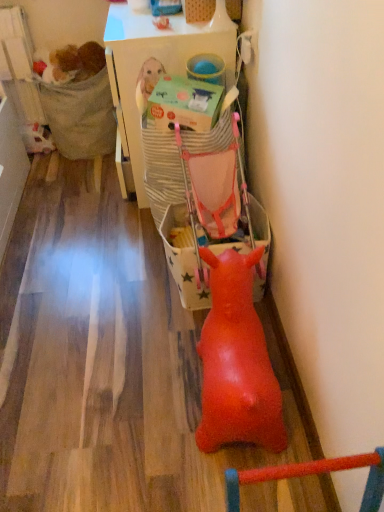
Describe the element at coordinates (80, 116) in the screenshot. This screenshot has width=384, height=512. I see `textured fabric chair at left` at that location.

The height and width of the screenshot is (512, 384). I want to click on matte green cardboard box at center, so click(x=184, y=104).

Locate an element on the screen. rubber duck at center is located at coordinates (236, 361).

Measure the distance between point (217, 196) and camera.

Point (217, 196) is 4.96 feet from camera.

Locate an element on the screen. white plastic table at upper center is located at coordinates click(156, 65).

Does white plastic table at upper center come behind textured fabric chair at left?

No, white plastic table at upper center is in front of textured fabric chair at left.

Is white plastic table at upper center facing away from textured fabric chair at left?

That's not correct — white plastic table at upper center is not looking away from textured fabric chair at left.

From a real-world perspective, does white plastic table at upper center sit lower than textured fabric chair at left?

No, from a real-world perspective, white plastic table at upper center is not beneath textured fabric chair at left.

Can you confirm if white plastic table at upper center is smaller than textured fabric chair at left?

Actually, white plastic table at upper center might be larger than textured fabric chair at left.

Considering the relative positions of white plastic table at upper center and fuzzy brown stuffed animal at upper left in the image provided, is white plastic table at upper center to the right of fuzzy brown stuffed animal at upper left from the viewer's perspective?

Indeed, white plastic table at upper center is positioned on the right side of fuzzy brown stuffed animal at upper left.

From the image's perspective, does white plastic table at upper center appear lower than fuzzy brown stuffed animal at upper left?

Yes, from the image's perspective, white plastic table at upper center is below fuzzy brown stuffed animal at upper left.

How much distance is there between white plastic table at upper center and fuzzy brown stuffed animal at upper left?

white plastic table at upper center is 61.18 centimeters from fuzzy brown stuffed animal at upper left.

Could you tell me if matte green cardboard box at center is facing white plastic table at upper center?

No, matte green cardboard box at center is not aimed at white plastic table at upper center.

Is matte green cardboard box at center shorter than white plastic table at upper center?

Correct, matte green cardboard box at center is not as tall as white plastic table at upper center.

Is point (157, 102) positioned in front of point (171, 48)?

Yes, it is in front of point (171, 48).

Which of these two, matte green cardboard box at center or white plastic table at upper center, is thinner?

Thinner between the two is matte green cardboard box at center.

Is rubber duck at center turned away from textured fabric chair at left?

No.

From a real-world perspective, is rubber duck at center below textured fabric chair at left?

Correct, in the physical world, rubber duck at center is lower than textured fabric chair at left.

In the image, is rubber duck at center positioned in front of or behind textured fabric chair at left?

Clearly, rubber duck at center is in front of textured fabric chair at left.

Does rubber duck at center have a lesser height compared to textured fabric chair at left?

In fact, rubber duck at center may be taller than textured fabric chair at left.

Which object is thinner, matte green cardboard box at center or rubber duck at center?

Thinner between the two is matte green cardboard box at center.

Is matte green cardboard box at center oriented towards rubber duck at center?

No, matte green cardboard box at center is not turned towards rubber duck at center.

Considering the positions of objects matte green cardboard box at center and rubber duck at center in the image provided, who is more to the right, matte green cardboard box at center or rubber duck at center?

Positioned to the right is rubber duck at center.

From the image's perspective, is matte green cardboard box at center located above or below textured fabric chair at left?

Based on their image positions, matte green cardboard box at center is located beneath textured fabric chair at left.

Is matte green cardboard box at center positioned before textured fabric chair at left?

Yes, matte green cardboard box at center is closer to the viewer.

Does textured fabric chair at left have a greater width compared to white plastic table at upper center?

Incorrect, the width of textured fabric chair at left does not surpass that of white plastic table at upper center.

Visually, is textured fabric chair at left positioned to the left or to the right of white plastic table at upper center?

Based on their positions, textured fabric chair at left is located to the left of white plastic table at upper center.

From a real-world perspective, between textured fabric chair at left and white plastic table at upper center, who is vertically lower?

In real-world perspective, textured fabric chair at left is lower.

Is textured fabric chair at left turned away from white plastic table at upper center?

That's not correct — textured fabric chair at left is not looking away from white plastic table at upper center.

Where is `chair behind the white plastic table at upper center`? This screenshot has height=512, width=384. chair behind the white plastic table at upper center is located at coordinates (80, 116).

At what (x,y) coordinates should I click in order to perform the action: click on table below the fuzzy brown stuffed animal at upper left (from a real-world perspective). Please return your answer as a coordinate pair (x, y). Looking at the image, I should click on (156, 65).

Looking at this image, based on their spatial positions, is fuzzy brown stuffed animal at upper left or white plastic table at upper center closer to matte pink baby carriage at center?

white plastic table at upper center.

When comparing their distances from matte green cardboard box at center, does fuzzy brown stuffed animal at upper left or white plastic table at upper center seem closer?

white plastic table at upper center.

From the image, which object appears to be farther from textured fabric chair at left, matte green cardboard box at center or matte pink baby carriage at center?

matte pink baby carriage at center is further to textured fabric chair at left.

From the image, which object appears to be farther from white plastic table at upper center, matte green cardboard box at center or textured fabric chair at left?

textured fabric chair at left lies further to white plastic table at upper center than the other object.

Which object lies further to the anchor point matte pink baby carriage at center, textured fabric chair at left or white plastic table at upper center?

textured fabric chair at left is further to matte pink baby carriage at center.

Which object lies further to the anchor point textured fabric chair at left, rubber duck at center or matte green cardboard box at center?

Based on the image, rubber duck at center appears to be further to textured fabric chair at left.

From the image, which object appears to be farther from fuzzy brown stuffed animal at upper left, rubber duck at center or matte pink baby carriage at center?

Among the two, rubber duck at center is located further to fuzzy brown stuffed animal at upper left.

Looking at this image, estimate the real-world distances between objects in this image. Which object is closer to matte green cardboard box at center, rubber duck at center or textured fabric chair at left?

rubber duck at center is closer to matte green cardboard box at center.

Identify the location of animal positioned between matte green cardboard box at center and textured fabric chair at left from near to far. The width and height of the screenshot is (384, 512). (74, 63).

Identify the location of chair between fuzzy brown stuffed animal at upper left and matte pink baby carriage at center from top to bottom. (80, 116).

Find the location of `box that lies between white plastic table at upper center and matte pink baby carriage at center from top to bottom`. box that lies between white plastic table at upper center and matte pink baby carriage at center from top to bottom is located at coordinates (184, 104).

Find the location of `box between textured fabric chair at left and matte pink baby carriage at center from top to bottom`. box between textured fabric chair at left and matte pink baby carriage at center from top to bottom is located at coordinates (184, 104).